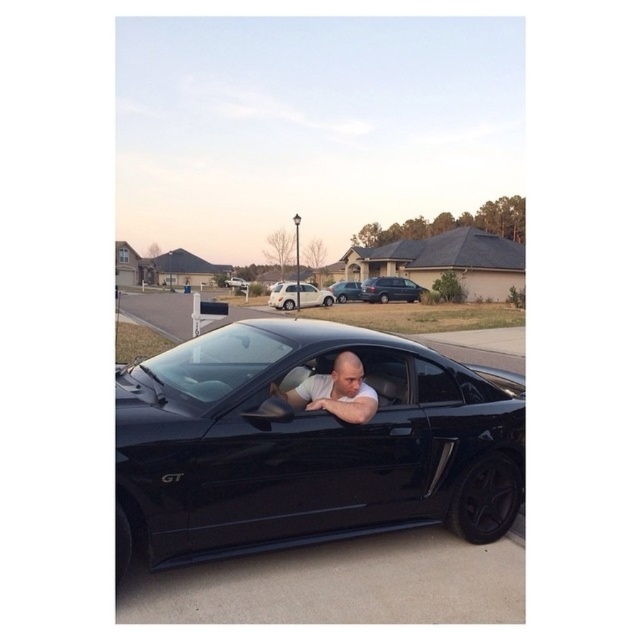
Question: Observing the image, what is the correct spatial positioning of glossy black car at center in reference to black glossy car at center?

Choices:
 (A) right
 (B) left

Answer: (A)

Question: Does matte gray minivan at center lie in front of black glossy car at center?

Choices:
 (A) no
 (B) yes

Answer: (B)

Question: Which point is farther from the camera taking this photo?

Choices:
 (A) click(x=138, y=467)
 (B) click(x=392, y=280)

Answer: (B)

Question: Which of the following is the closest to the observer?

Choices:
 (A) (248, 284)
 (B) (291, 403)
 (C) (324, 374)
 (D) (413, 288)

Answer: (B)

Question: Among these objects, which one is nearest to the camera?

Choices:
 (A) matte gray minivan at center
 (B) black glossy car at center

Answer: (A)

Question: Does white matte suv at center have a greater width compared to black glossy car at center?

Choices:
 (A) yes
 (B) no

Answer: (B)